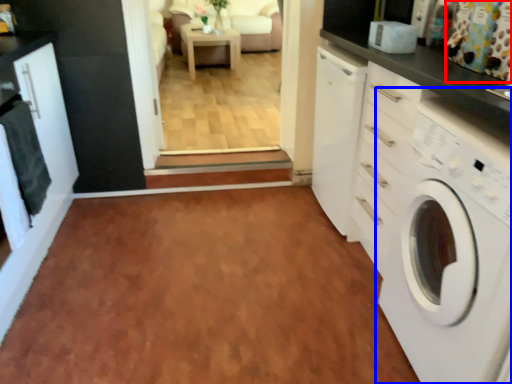
Question: Which point is closer to the camera, curtain (highlighted by a red box) or washing machine (highlighted by a blue box)?

Choices:
 (A) curtain
 (B) washing machine

Answer: (B)